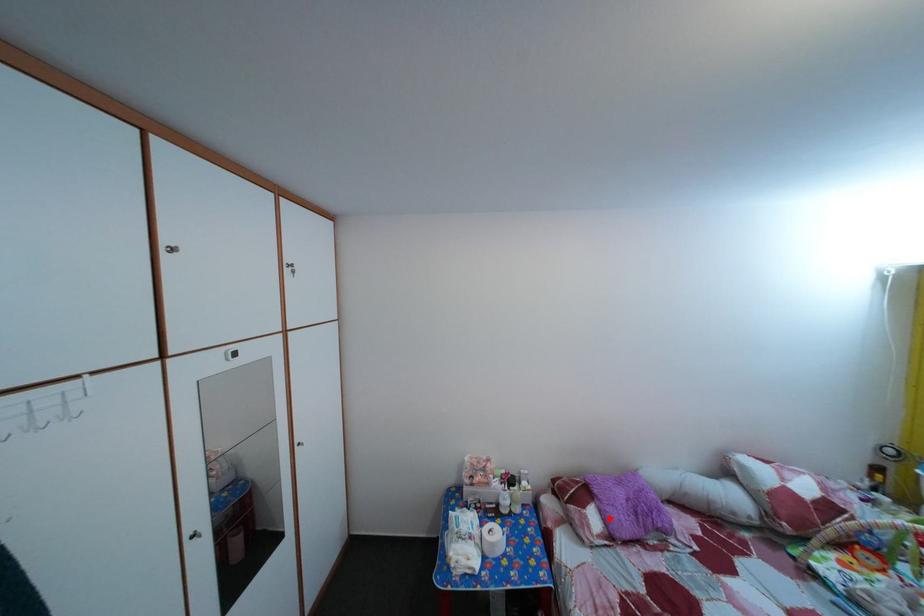
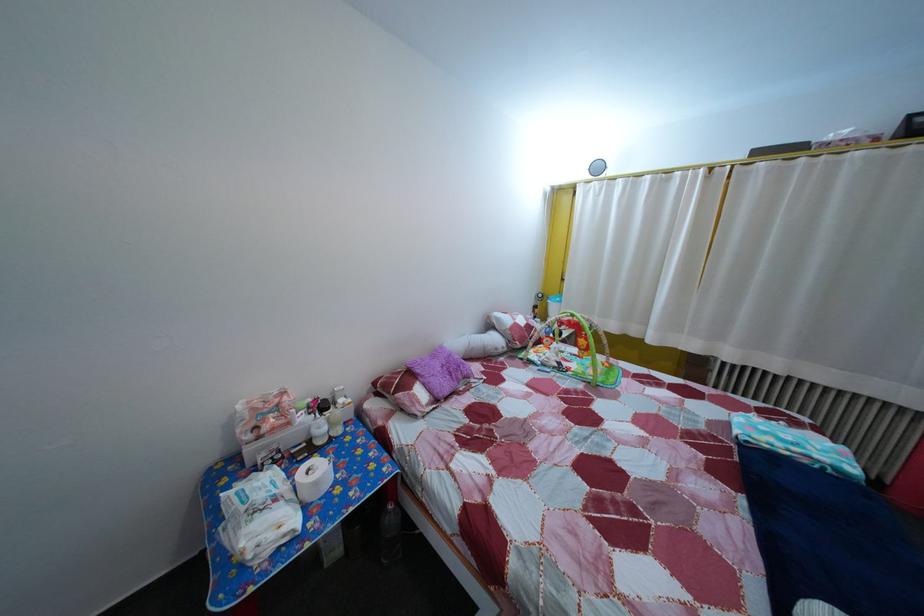
The point at the highlighted location is marked in the first image. Where is the corresponding point in the second image?

(433, 392)